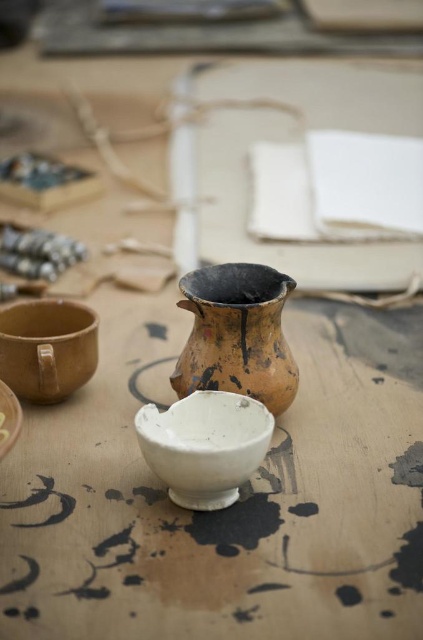
You are a photographer setting up a shot of the pottery items on the table. You need to position a light source so that it illuminates both the point at coordinates point (38,342) and point (7,444) equally. Given their positions relative to the camera, which point should you place closer to the light source to achieve even lighting?

Point (38,342) is further to the camera than point (7,444). To achieve even lighting, you should place the light source closer to point (7,444) since it is closer to the camera and requires more light to compensate for its distance from the light source.

You are an artist trying to reach the matte brown bowl at lower left to add some glaze. Is the white glossy bowl at center blocking your access to it?

The white glossy bowl at center is closer to the viewer than the matte brown bowl at lower left, so it is blocking access to the matte brown bowl at lower left.